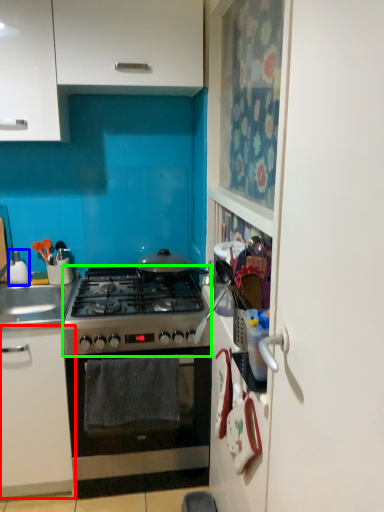
Question: Estimate the real-world distances between objects in this image. Which object is closer to cabinetry (highlighted by a red box), appliance (highlighted by a blue box) or gas stove (highlighted by a green box)?

Choices:
 (A) appliance
 (B) gas stove

Answer: (B)